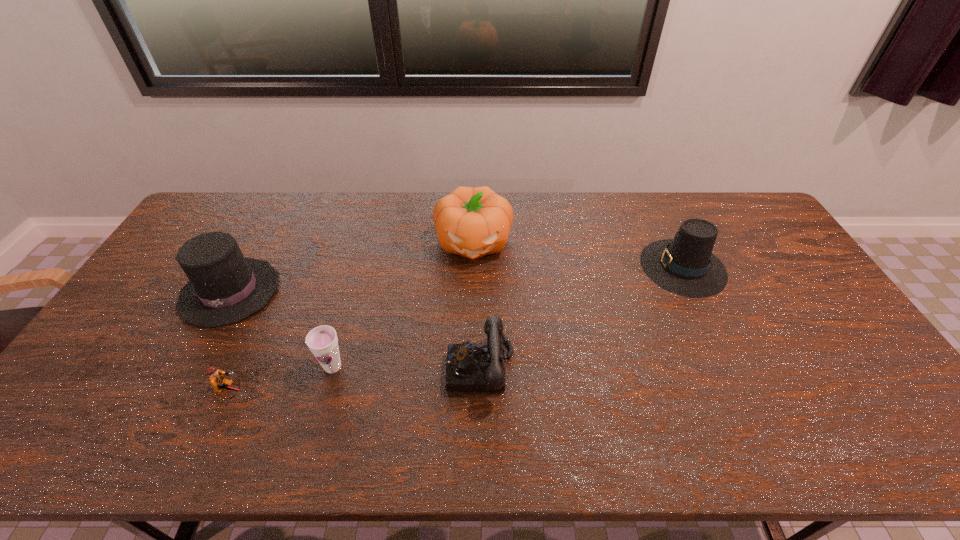
You are a GUI agent. You are given a task and a screenshot of the screen. Output one action in this format:
    pyautogui.click(x=<x>, y=<y>)
    Task: Click on the vacant space that's between the cup and the pumpkin
    
    Given the screenshot: What is the action you would take?
    pyautogui.click(x=403, y=305)

Locate which object ranks fifth in proximity to the telephone. Please provide its 2D coordinates. Your answer should be formatted as a tuple, i.e. [(x, y)], where the tuple contains the x and y coordinates of a point satisfying the conditions above.

[(224, 288)]

Identify which object is located as the fourth nearest to the telephone. Please provide its 2D coordinates. Your answer should be formatted as a tuple, i.e. [(x, y)], where the tuple contains the x and y coordinates of a point satisfying the conditions above.

[(217, 378)]

You are a GUI agent. You are given a task and a screenshot of the screen. Output one action in this format:
    pyautogui.click(x=<x>, y=<y>)
    Task: Click on the vacant space that satisfies the following two spatial constraints: 1. on the front of the cup with the decoration; 2. on the left side of the left hat
    The width and height of the screenshot is (960, 540).
    Given the screenshot: What is the action you would take?
    pyautogui.click(x=189, y=367)

Identify the location of blank area in the image that satisfies the following two spatial constraints: 1. on the front of the left hat with the decoration; 2. on the left side of the cup. (189, 367).

Find the location of a particular element. vacant region that satisfies the following two spatial constraints: 1. on the front of the third object from left to right with the decoration; 2. on the left side of the left hat is located at coordinates pos(189,367).